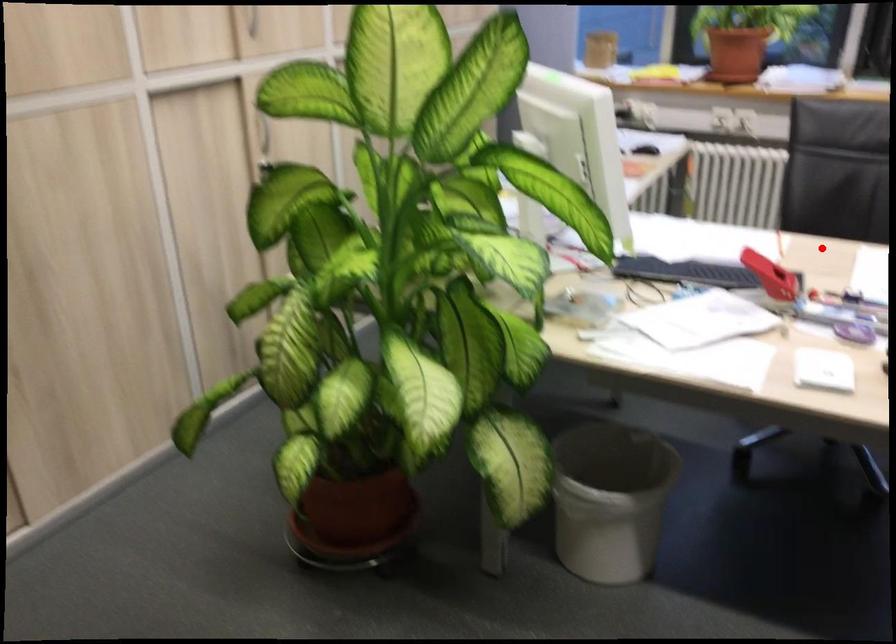
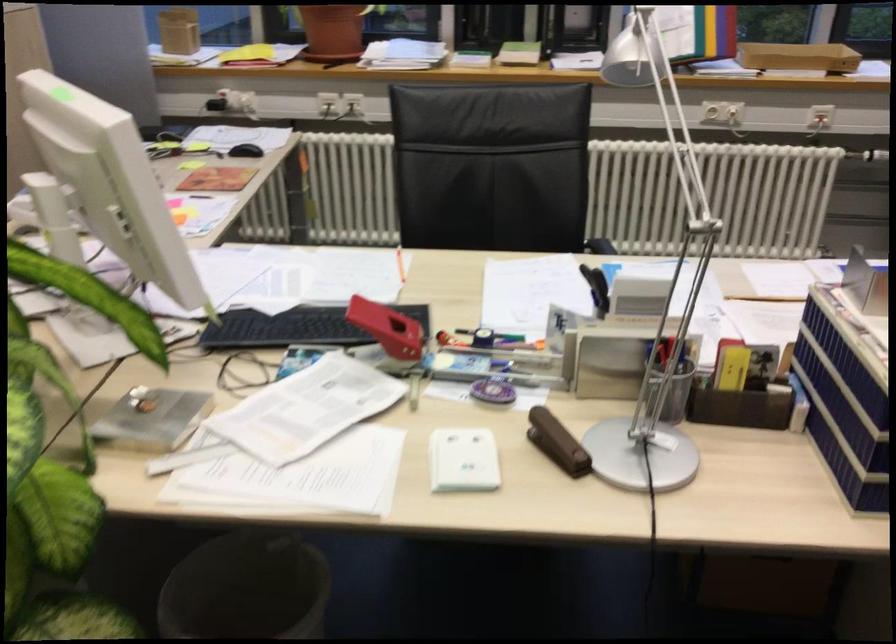
Question: A red point is marked in image1. In image2, is the corresponding 3D point closer to the camera or farther? Reply with the corresponding letter.

Choices:
 (A) The corresponding 3D point is closer.
 (B) The corresponding 3D point is farther.

Answer: (A)